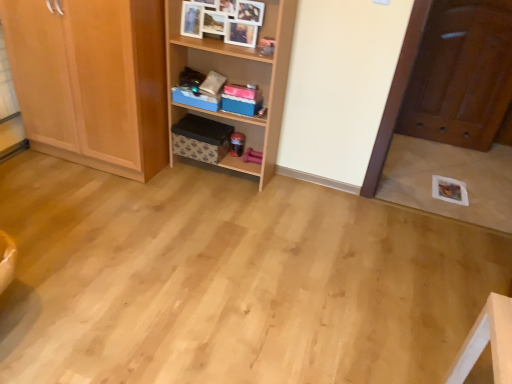
Identify the location of free space in front of shiny brown door at right. Image resolution: width=512 pixels, height=384 pixels. (450, 164).